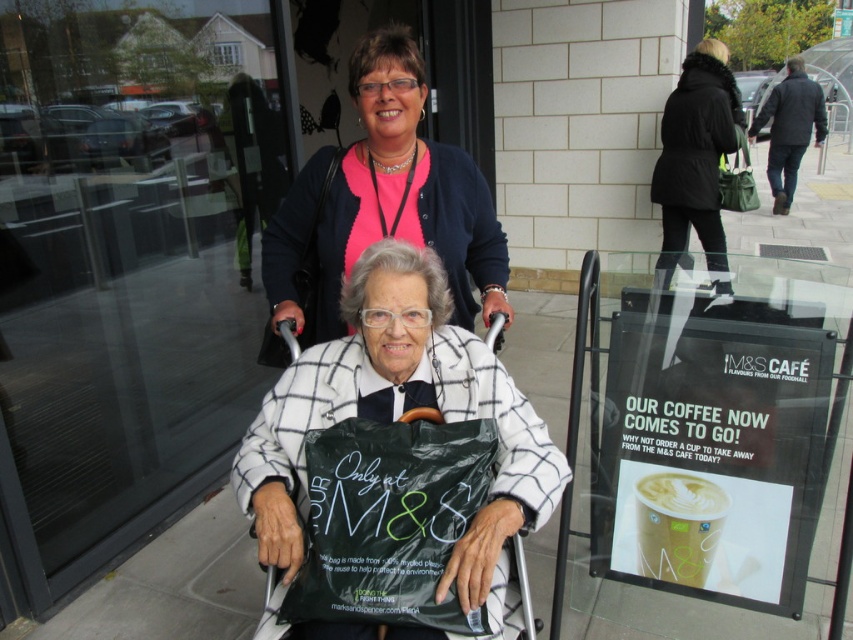
You are standing in front of the M.S. store and want to walk to the point that is closer to you. Which point should you head towards, point [502,624] or point [718,112]?

Point [502,624] is closer to the viewer than point [718,112], so you should head towards point [502,624].

You are a fashion designer observing two coats in the image. The white checkered coat at center and the black fur coat at upper right. Which coat is closer to the ground?

The white checkered coat at center is closer to the ground because it is positioned under the black fur coat at upper right.

You are a photographer trying to capture the white checkered coat at center in a photo. The camera you are using has a rectangular viewfinder with coordinates from 0 to 1 on both axes. The point at (399, 417) is part of the white checkered coat at center. If you want to ensure the entire white checkered coat at center is in the photo, would you need to adjust the camera angle upwards or downwards?

The point at (399, 417) is part of the white checkered coat at center. Since this point is located in the lower half of the viewfinder, you would need to adjust the camera angle upwards slightly to ensure the entire coat is captured.